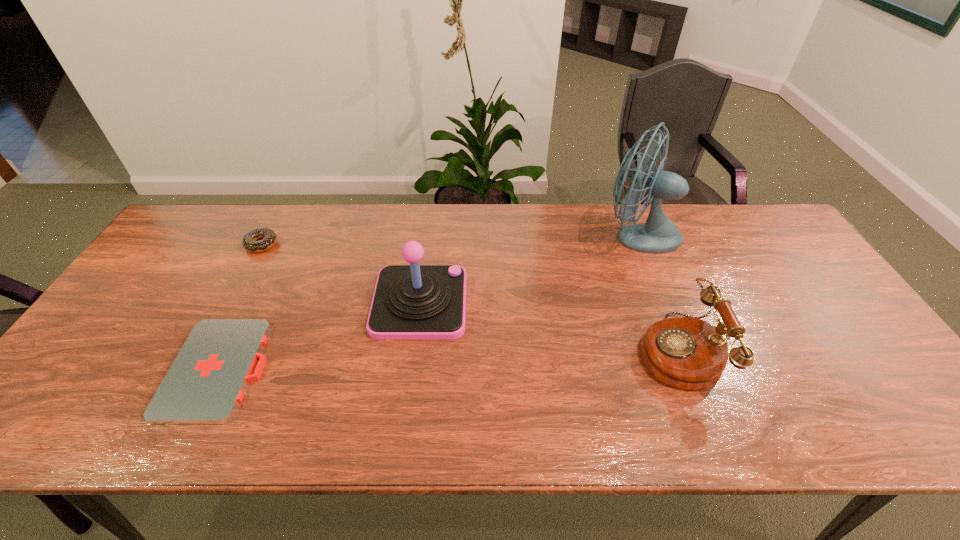
Locate an element on the screen. the tallest object is located at coordinates (658, 234).

Where is `the fourth shortest object`? This screenshot has width=960, height=540. the fourth shortest object is located at coordinates (410, 302).

Find the location of a particular element. The height and width of the screenshot is (540, 960). the third object from left to right is located at coordinates (410, 302).

This screenshot has height=540, width=960. Identify the location of telephone. (688, 353).

I want to click on the fourth tallest object, so click(249, 241).

Identify the location of the first-aid kit. This screenshot has width=960, height=540. (205, 383).

Where is `vacant region located in front of the fan to blow air`? vacant region located in front of the fan to blow air is located at coordinates (475, 235).

The width and height of the screenshot is (960, 540). Identify the location of vacant area located 0.190m in front of the fan to blow air. (538, 235).

You are a GUI agent. You are given a task and a screenshot of the screen. Output one action in this format:
    pyautogui.click(x=<x>, y=<y>)
    Task: Click on the vacant space situated 0.150m in front of the fan to blow air
    This screenshot has width=960, height=540.
    Given the screenshot: What is the action you would take?
    pyautogui.click(x=550, y=235)

Find the location of `vacant space located forward from the base of the third object from right to left`. vacant space located forward from the base of the third object from right to left is located at coordinates pos(540,303).